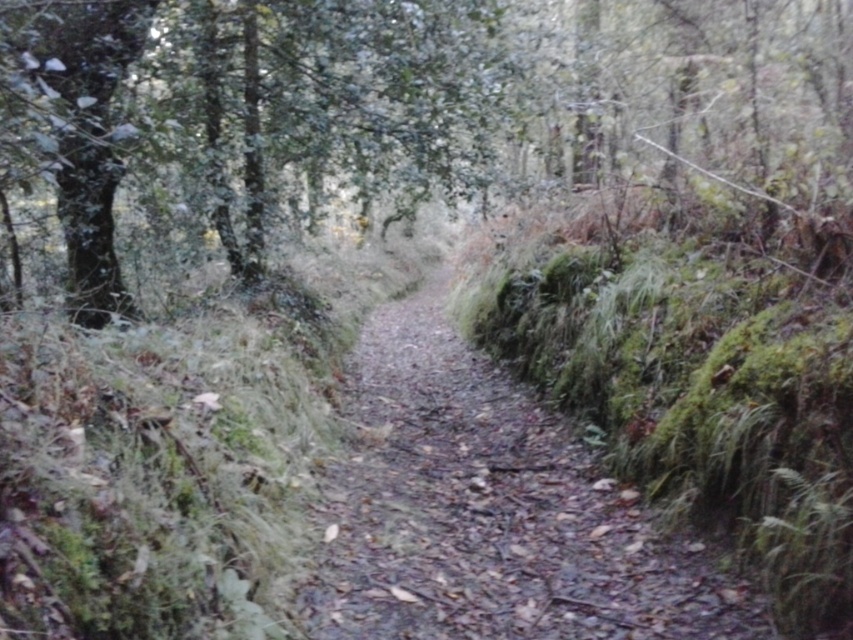
You are a hiker trying to navigate a narrow forest path. You see two green mossy trees ahead. The first is the green mossy tree at center, and the second is the green mossy tree at upper left. Which tree should you avoid walking towards if you want to stay on the path?

You should avoid walking towards the green mossy tree at upper left because the green mossy tree at center is bigger, indicating it is closer to the path. The smaller tree at upper left might be further away from the path or in a different area.

You are a hiker walking along the damp dirt path at center and see the green mossy tree at center. Which direction should you turn to face the tree?

The green mossy tree at center is to the left of damp dirt path at center, so you should turn to your left to face the tree.